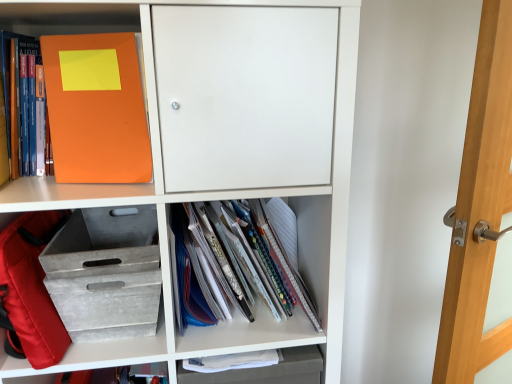
The height and width of the screenshot is (384, 512). In order to click on orange matte folder at upper left, the first shelf when ordered from top to bottom in this screenshot , I will do `click(81, 189)`.

Describe the element at coordinates (21, 99) in the screenshot. This screenshot has width=512, height=384. I see `orange matte folder at upper left, marked as the first book in a top-to-bottom arrangement` at that location.

How much space does gray textured crate at lower left, acting as the 1th shelf starting from the bottom, occupy vertically?

8.48 inches.

What is the approximate width of white paper notebook at center, which is the 1th book in bottom-to-top order?

8.54 inches.

Locate an element on the screen. This screenshot has height=384, width=512. orange matte folder at upper left, positioned as the 3th shelf in bottom-to-top order is located at coordinates (81, 189).

Does orange matte folder at upper left, marked as the 2th book in a bottom-to-top arrangement, have a greater width compared to transparent glass door at right?

Incorrect, the width of orange matte folder at upper left, marked as the 2th book in a bottom-to-top arrangement, does not surpass that of transparent glass door at right.

From a real-world perspective, starting from the transparent glass door at right, which book is the 2nd one vertically above it? Please provide its 2D coordinates.

[(21, 99)]

Does orange matte folder at upper left, placed as the second book when sorted from right to left, turn towards transparent glass door at right?

No, orange matte folder at upper left, placed as the second book when sorted from right to left, is not turned towards transparent glass door at right.

From a real-world perspective, which object rests below the other?

transparent glass door at right, from a real-world perspective.

Are orange matte folder at upper left, positioned as the 3th shelf in bottom-to-top order, and white paper notebook at center, which is counted as the 1th book, starting from the right, beside each other?

There is a gap between orange matte folder at upper left, positioned as the 3th shelf in bottom-to-top order, and white paper notebook at center, which is counted as the 1th book, starting from the right.

Between orange matte folder at upper left, positioned as the 3th shelf in bottom-to-top order, and white paper notebook at center, the 2th book when ordered from left to right, which one has larger size?

white paper notebook at center, the 2th book when ordered from left to right, is bigger.

From the image's perspective, is orange matte folder at upper left, positioned as the 3th shelf in bottom-to-top order, under white paper notebook at center, which is the second book in top-to-bottom order?

No, from the image's perspective, orange matte folder at upper left, positioned as the 3th shelf in bottom-to-top order, is not beneath white paper notebook at center, which is the second book in top-to-bottom order.

Is point (11, 200) closer or farther from the camera than point (259, 278)?

Point (11, 200) appears to be closer to the viewer than point (259, 278).

Can we say orange matte folder at upper left, positioned as the 3th shelf in bottom-to-top order, lies outside transparent glass door at right?

Yes, orange matte folder at upper left, positioned as the 3th shelf in bottom-to-top order, is located beyond the bounds of transparent glass door at right.

Which point is more distant from viewer, (68,197) or (485,236)?

The point (485,236) is more distant.

Considering the relative sizes of orange matte folder at upper left, positioned as the 3th shelf in bottom-to-top order, and transparent glass door at right in the image provided, is orange matte folder at upper left, positioned as the 3th shelf in bottom-to-top order, taller than transparent glass door at right?

No, orange matte folder at upper left, positioned as the 3th shelf in bottom-to-top order, is not taller than transparent glass door at right.

Which of these two, orange matte folder at upper left, placed as the second shelf when sorted from top to bottom, or transparent glass door at right, is wider?

Wider between the two is orange matte folder at upper left, placed as the second shelf when sorted from top to bottom.

Is orange matte folder at upper left, placed as the second shelf when sorted from top to bottom, turned away from transparent glass door at right?

orange matte folder at upper left, placed as the second shelf when sorted from top to bottom, does not have its back to transparent glass door at right.

Is transparent glass door at right located within orange matte folder at upper left, placed as the second shelf when sorted from top to bottom?

No, transparent glass door at right is not inside orange matte folder at upper left, placed as the second shelf when sorted from top to bottom.

Does orange matte folder at upper left, placed as the second shelf when sorted from top to bottom, lie behind transparent glass door at right?

No, orange matte folder at upper left, placed as the second shelf when sorted from top to bottom, is closer to the camera.

How much distance is there between transparent glass door at right and orange matte folder at upper left, arranged as the second shelf when ordered from the bottom?

They are 15.72 inches apart.

From a real-world perspective, is transparent glass door at right positioned over orange matte folder at upper left, placed as the second shelf when sorted from top to bottom, based on gravity?

No, from a real-world perspective, transparent glass door at right is not above orange matte folder at upper left, placed as the second shelf when sorted from top to bottom.

Does point (454, 279) come closer to viewer compared to point (309, 210)?

Yes, it is.

Between transparent glass door at right and orange matte folder at upper left, arranged as the second shelf when ordered from the bottom, which one appears on the right side from the viewer's perspective?

transparent glass door at right.

Between red fabric backpack at lower left and transparent glass door at right, which one appears on the left side from the viewer's perspective?

Positioned to the left is red fabric backpack at lower left.

Between red fabric backpack at lower left and transparent glass door at right, which one has larger size?

transparent glass door at right is bigger.

How different are the orientations of red fabric backpack at lower left and transparent glass door at right in degrees?

They differ by 22.4 degrees in their facing directions.

Is red fabric backpack at lower left outside of transparent glass door at right?

Yes.

In terms of size, does transparent glass door at right appear bigger or smaller than red fabric backpack at lower left?

In the image, transparent glass door at right appears to be larger than red fabric backpack at lower left.

Looking at this image, in terms of width, does transparent glass door at right look wider or thinner when compared to red fabric backpack at lower left?

Clearly, transparent glass door at right has less width compared to red fabric backpack at lower left.

I want to click on backpack lying below the transparent glass door at right (from the image's perspective), so click(30, 290).

From a real-world perspective, between transparent glass door at right and red fabric backpack at lower left, who is vertically lower?

transparent glass door at right is physically lower.

Where is `glass door that appears below the orange matte folder at upper left, marked as the 2th book in a bottom-to-top arrangement (from a real-world perspective)`? The image size is (512, 384). glass door that appears below the orange matte folder at upper left, marked as the 2th book in a bottom-to-top arrangement (from a real-world perspective) is located at coordinates (479, 208).

Locate an element on the screen. This screenshot has width=512, height=384. shelf above the white paper notebook at center, which is the second book in top-to-bottom order (from the image's perspective) is located at coordinates (81, 189).

Looking at the image, which one is located further to red fabric backpack at lower left, orange matte folder at upper left, arranged as the second shelf when ordered from the bottom, or gray textured crate at lower left, acting as the 1th shelf starting from the bottom?

Among the two, orange matte folder at upper left, arranged as the second shelf when ordered from the bottom, is located further to red fabric backpack at lower left.

Looking at the image, which one is located closer to orange matte folder at upper left, positioned as the 3th shelf in bottom-to-top order, white paper notebook at center, which is the second book in top-to-bottom order, or red fabric backpack at lower left?

The object closer to orange matte folder at upper left, positioned as the 3th shelf in bottom-to-top order, is red fabric backpack at lower left.

Looking at the image, which one is located further to orange matte folder at upper left, marked as the first book in a top-to-bottom arrangement, white paper notebook at center, which is the 1th book in bottom-to-top order, or orange matte folder at upper left, the first shelf when ordered from top to bottom?

Based on the image, white paper notebook at center, which is the 1th book in bottom-to-top order, appears to be further to orange matte folder at upper left, marked as the first book in a top-to-bottom arrangement.

Looking at the image, which one is located closer to white paper notebook at center, which is the second book in top-to-bottom order, orange matte folder at upper left, placed as the second shelf when sorted from top to bottom, or transparent glass door at right?

The object closer to white paper notebook at center, which is the second book in top-to-bottom order, is orange matte folder at upper left, placed as the second shelf when sorted from top to bottom.

Estimate the real-world distances between objects in this image. Which object is closer to transparent glass door at right, gray textured crate at lower left, arranged as the 3th shelf when viewed from the top, or orange matte folder at upper left, arranged as the 1th book when viewed from the left?

gray textured crate at lower left, arranged as the 3th shelf when viewed from the top.

When comparing their distances from transparent glass door at right, does white paper notebook at center, the 2th book when ordered from left to right, or orange matte folder at upper left, positioned as the 3th shelf in bottom-to-top order, seem further?

orange matte folder at upper left, positioned as the 3th shelf in bottom-to-top order, is positioned further to the anchor transparent glass door at right.

Estimate the real-world distances between objects in this image. Which object is further from white paper notebook at center, which is the 1th book in bottom-to-top order, orange matte folder at upper left, placed as the second shelf when sorted from top to bottom, or orange matte folder at upper left, placed as the second book when sorted from right to left?

Among the two, orange matte folder at upper left, placed as the second book when sorted from right to left, is located further to white paper notebook at center, which is the 1th book in bottom-to-top order.

From the image, which object appears to be nearer to orange matte folder at upper left, the first shelf when ordered from top to bottom, gray textured crate at lower left, acting as the 1th shelf starting from the bottom, or orange matte folder at upper left, placed as the second shelf when sorted from top to bottom?

The object closer to orange matte folder at upper left, the first shelf when ordered from top to bottom, is orange matte folder at upper left, placed as the second shelf when sorted from top to bottom.

This screenshot has height=384, width=512. Find the location of `shelf between orange matte folder at upper left, positioned as the 3th shelf in bottom-to-top order, and gray textured crate at lower left, acting as the 1th shelf starting from the bottom, from top to bottom`. shelf between orange matte folder at upper left, positioned as the 3th shelf in bottom-to-top order, and gray textured crate at lower left, acting as the 1th shelf starting from the bottom, from top to bottom is located at coordinates (226, 198).

Locate an element on the screen. The width and height of the screenshot is (512, 384). backpack between orange matte folder at upper left, arranged as the second shelf when ordered from the bottom, and gray textured crate at lower left, acting as the 1th shelf starting from the bottom, from front to back is located at coordinates (30, 290).

You are a GUI agent. You are given a task and a screenshot of the screen. Output one action in this format:
    pyautogui.click(x=<x>, y=<y>)
    Task: Click on the book between orange matte folder at upper left, positioned as the 3th shelf in bottom-to-top order, and orange matte folder at upper left, placed as the second shelf when sorted from top to bottom, vertically
    
    Given the screenshot: What is the action you would take?
    click(245, 258)

In order to click on book between orange matte folder at upper left, marked as the first book in a top-to-bottom arrangement, and transparent glass door at right, in the horizontal direction in this screenshot , I will do `click(245, 258)`.